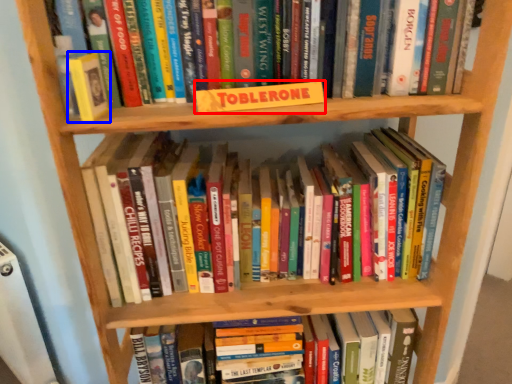
Question: Among these objects, which one is farthest to the camera, paperback book (highlighted by a red box) or paperback book (highlighted by a blue box)?

Choices:
 (A) paperback book
 (B) paperback book

Answer: (A)